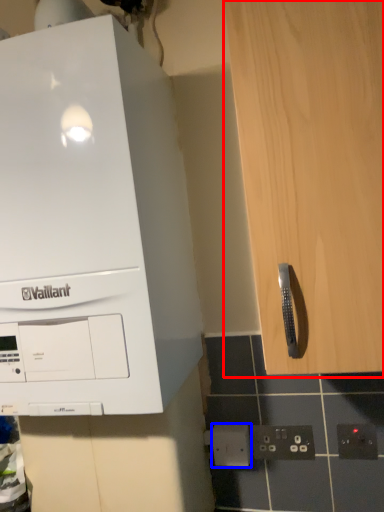
Question: Which point is closer to the camera, cabinetry (highlighted by a red box) or electric outlet (highlighted by a blue box)?

Choices:
 (A) cabinetry
 (B) electric outlet

Answer: (A)